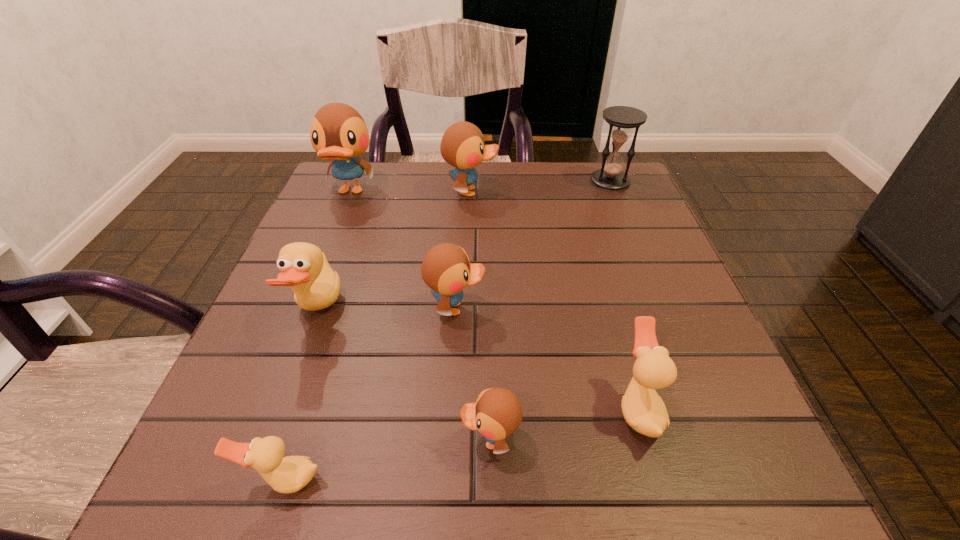
Locate which tan duck is the closest to the third smallest blue duck. Please provide its 2D coordinates. Your answer should be formatted as a tuple, i.e. [(x, y)], where the tuple contains the x and y coordinates of a point satisfying the conditions above.

[(304, 266)]

Locate which tan duck ranks in proximity to the nearest blue duck. Please provide its 2D coordinates. Your answer should be formatted as a tuple, i.e. [(x, y)], where the tuple contains the x and y coordinates of a point satisfying the conditions above.

[(643, 409)]

Locate an element on the screen. This screenshot has height=540, width=960. vacant space that satisfies the following two spatial constraints: 1. on the front-facing side of the second smallest blue duck; 2. on the beak of the nearest tan duck is located at coordinates pos(446,480).